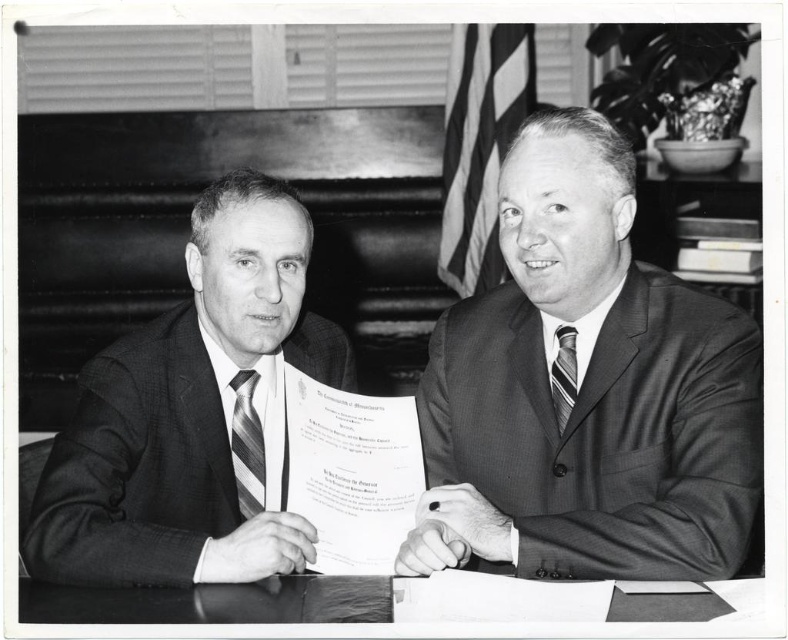
Question: Is matte black suit at left bigger than striped silk tie at left?

Choices:
 (A) no
 (B) yes

Answer: (B)

Question: Does smooth suit at center come behind striped fabric tie at center?

Choices:
 (A) yes
 (B) no

Answer: (B)

Question: Can you confirm if smooth suit at center is positioned below striped silk tie at left?

Choices:
 (A) yes
 (B) no

Answer: (B)

Question: Which point is farther to the camera?

Choices:
 (A) (329, 424)
 (B) (140, 531)

Answer: (A)

Question: Which object is positioned farthest from the striped silk tie at left?

Choices:
 (A) smooth suit at center
 (B) smooth paper document at center

Answer: (A)

Question: Among these points, which one is farthest from the camera?

Choices:
 (A) (407, 509)
 (B) (132, 598)
 (C) (240, 400)
 (D) (552, 401)

Answer: (C)